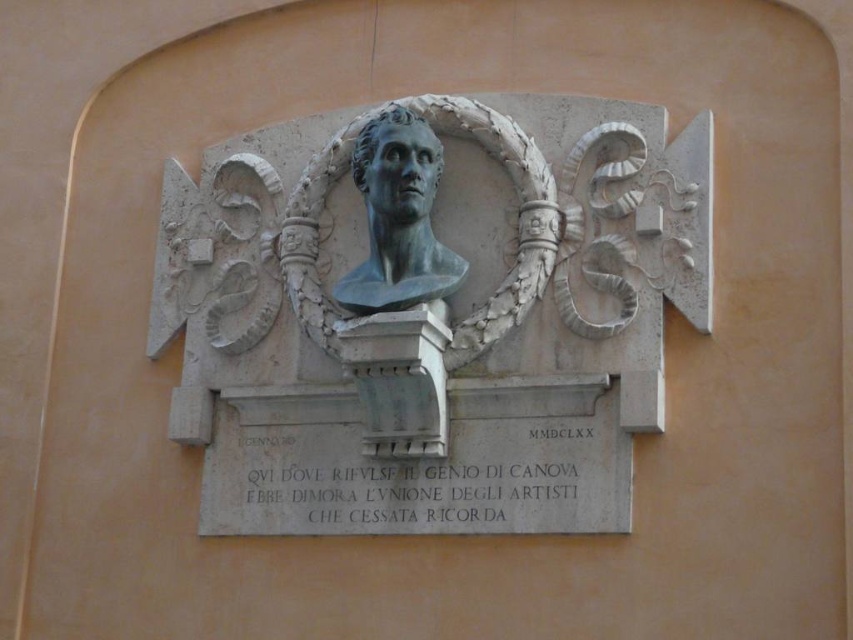
You are an art conservator examining the wall where the black stone plaque at center and bronze bust at center are displayed. You need to clean both items. Which one should you approach first without moving the other?

You should clean the black stone plaque at center first because it is in front of the bronze bust at center, making it accessible without disturbing the one behind.